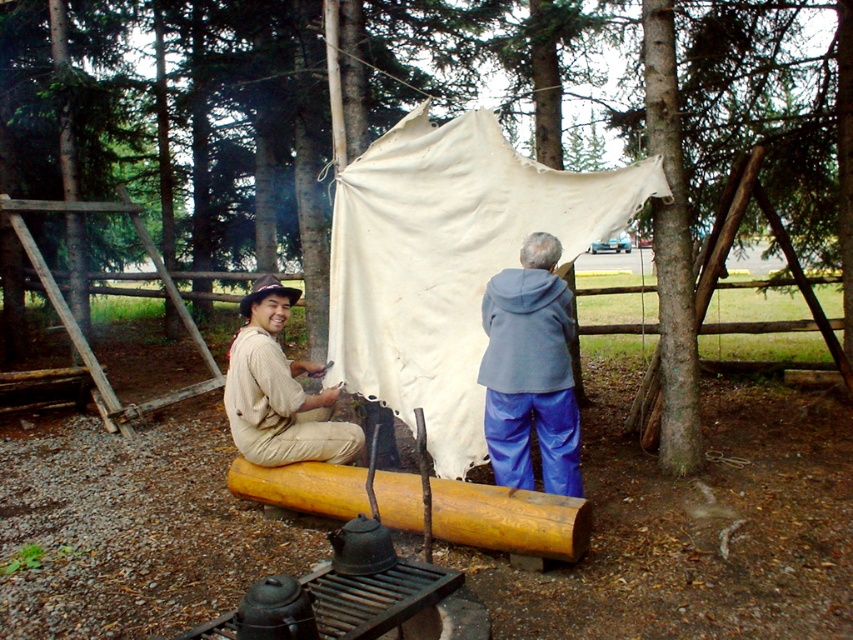
Is blue rubber pants at center above yellow wood log at center?

Indeed, blue rubber pants at center is positioned over yellow wood log at center.

Does point (514, 272) come behind point (550, 548)?

Yes, it is behind point (550, 548).

Does point (512, 384) come farther from viewer compared to point (547, 516)?

That is True.

Identify the location of blue rubber pants at center. (531, 371).

This screenshot has height=640, width=853. What do you see at coordinates (509, 518) in the screenshot?
I see `yellow wood log at center` at bounding box center [509, 518].

Measure the distance between yellow wood log at center and camera.

The distance of yellow wood log at center from camera is 11.64 feet.

Does point (447, 509) come farther from viewer compared to point (270, 406)?

No, it is not.

The image size is (853, 640). In order to click on yellow wood log at center in this screenshot , I will do `click(509, 518)`.

Does beige corduroy pants at center come behind blue rubber pants at center?

No, beige corduroy pants at center is closer to the viewer.

This screenshot has width=853, height=640. Describe the element at coordinates (531, 371) in the screenshot. I see `beige corduroy pants at center` at that location.

At what (x,y) coordinates should I click in order to perform the action: click on beige corduroy pants at center. Please return your answer as a coordinate pair (x, y). Looking at the image, I should click on (531, 371).